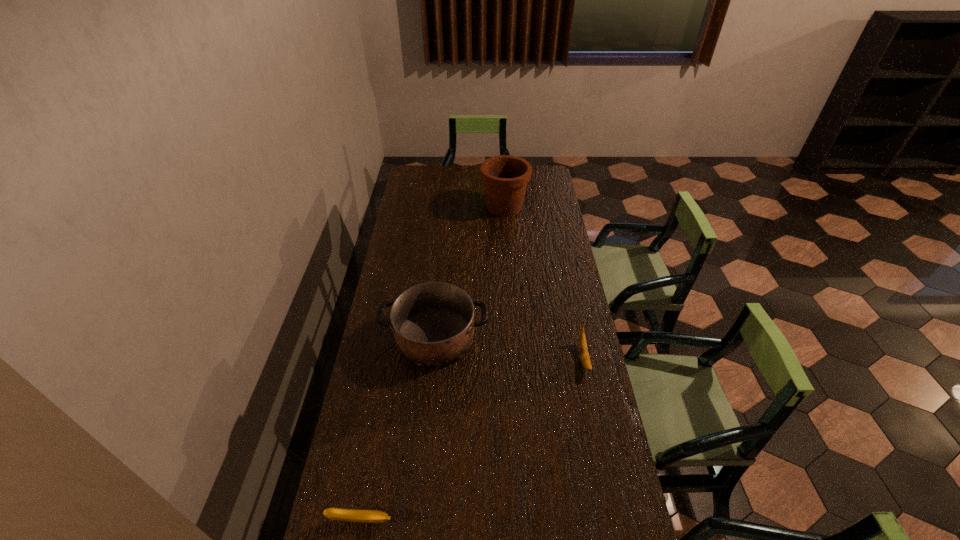
The image size is (960, 540). In order to click on the tallest object in this screenshot , I will do `click(505, 177)`.

This screenshot has height=540, width=960. What are the coordinates of `the farthest object` in the screenshot? It's located at (505, 177).

Locate an element on the screen. This screenshot has width=960, height=540. saucepan is located at coordinates (433, 323).

Locate an element on the screen. The image size is (960, 540). the taller banana is located at coordinates (583, 349).

In order to click on the farther banana in this screenshot , I will do `click(583, 349)`.

You are a GUI agent. You are given a task and a screenshot of the screen. Output one action in this format:
    pyautogui.click(x=<x>, y=<y>)
    Task: Click on the nearest object
    The width and height of the screenshot is (960, 540).
    Given the screenshot: What is the action you would take?
    pyautogui.click(x=369, y=516)

You are a GUI agent. You are given a task and a screenshot of the screen. Output one action in this format:
    pyautogui.click(x=<x>, y=<y>)
    Task: Click on the shortest object
    Image resolution: width=960 pixels, height=540 pixels.
    Given the screenshot: What is the action you would take?
    pyautogui.click(x=369, y=516)

Find the location of a particular element. Image resolution: width=960 pixels, height=540 pixels. vacant position located 0.080m on the right of the tallest object is located at coordinates (544, 207).

Where is `blank area located on the front of the third shortest object`? blank area located on the front of the third shortest object is located at coordinates (425, 436).

The height and width of the screenshot is (540, 960). In order to click on vacant area situated 0.360m on the peel of the rightmost object from the top in this screenshot , I will do `click(611, 487)`.